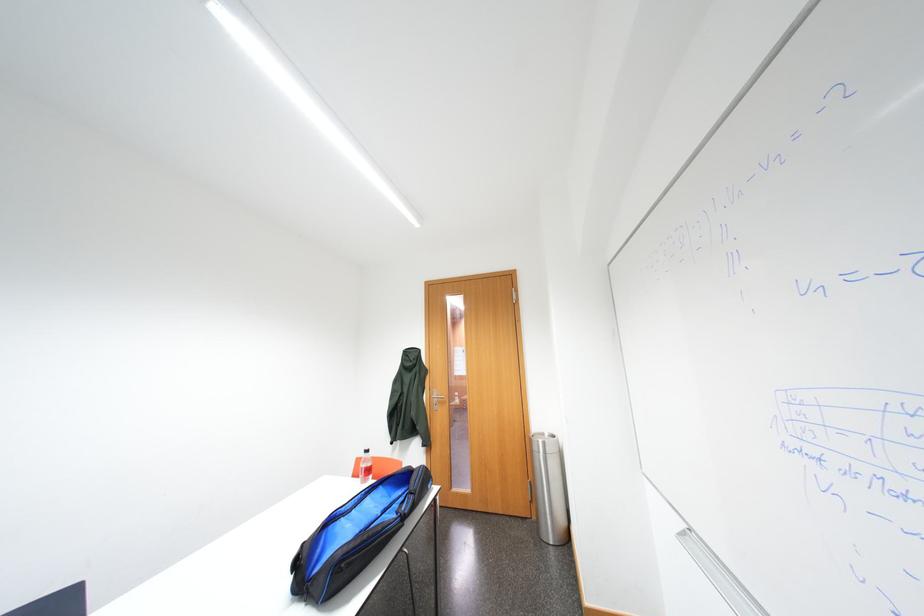
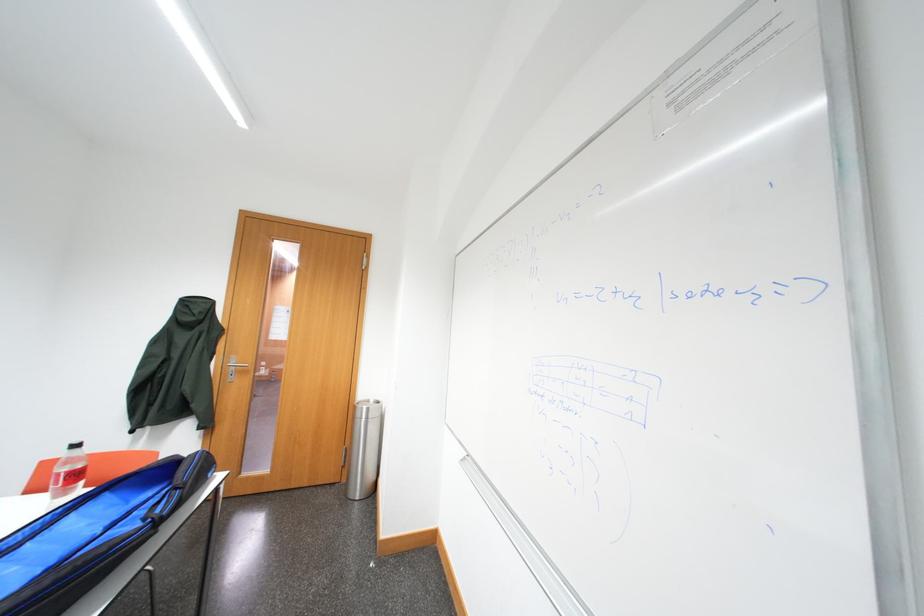
Question: The first image is from the beginning of the video and the second image is from the end. How did the camera likely rotate when shooting the video?

Choices:
 (A) Left
 (B) Right
 (C) Up
 (D) Down

Answer: (B)